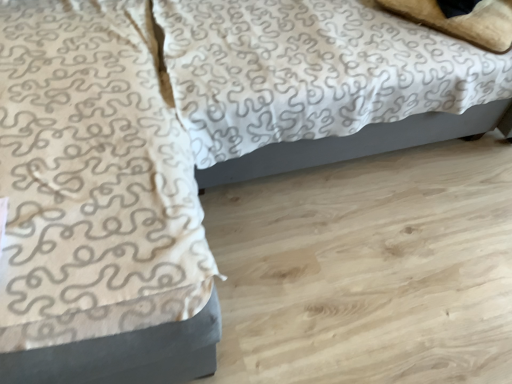
The width and height of the screenshot is (512, 384). Describe the element at coordinates (318, 83) in the screenshot. I see `white textured fabric at center` at that location.

Find the location of a particular element. beige soft pillow at upper right is located at coordinates (462, 21).

Where is `white textured blanket at upper left`? The image size is (512, 384). white textured blanket at upper left is located at coordinates (92, 178).

Which of these two, white textured fabric at center or white textured blanket at upper left, is smaller?

white textured blanket at upper left.

Considering the relative sizes of white textured fabric at center and white textured blanket at upper left in the image provided, is white textured fabric at center wider than white textured blanket at upper left?

Incorrect, the width of white textured fabric at center does not surpass that of white textured blanket at upper left.

Is white textured blanket at upper left located within white textured fabric at center?

No, white textured blanket at upper left is not a part of white textured fabric at center.

Is white textured fabric at center aimed at white textured blanket at upper left?

No, white textured fabric at center does not turn towards white textured blanket at upper left.

Which of these two, beige soft pillow at upper right or white textured blanket at upper left, is thinner?

With smaller width is beige soft pillow at upper right.

In the scene shown: Is beige soft pillow at upper right facing towards white textured blanket at upper left?

Yes, beige soft pillow at upper right is facing white textured blanket at upper left.

From a real-world perspective, is beige soft pillow at upper right located beneath white textured blanket at upper left?

No, from a real-world perspective, beige soft pillow at upper right is not beneath white textured blanket at upper left.

Considering the points (484, 0) and (56, 186), which point is in front, point (484, 0) or point (56, 186)?

Positioned in front is point (56, 186).

How many degrees apart are the facing directions of beige soft pillow at upper right and white textured fabric at center?

There is a 48.4-degree angle between the facing directions of beige soft pillow at upper right and white textured fabric at center.

From a real-world perspective, who is located lower, beige soft pillow at upper right or white textured fabric at center?

In real-world perspective, white textured fabric at center is lower.

Considering the sizes of objects beige soft pillow at upper right and white textured fabric at center in the image provided, who is thinner, beige soft pillow at upper right or white textured fabric at center?

Thinner between the two is beige soft pillow at upper right.

I want to click on pillow above the white textured fabric at center (from a real-world perspective), so click(462, 21).

From a real-world perspective, which is physically below, white textured blanket at upper left or beige soft pillow at upper right?

white textured blanket at upper left, from a real-world perspective.

From the image's perspective, is white textured blanket at upper left above or below beige soft pillow at upper right?

From the image's perspective, white textured blanket at upper left appears below beige soft pillow at upper right.

Looking at their sizes, would you say white textured blanket at upper left is wider or thinner than beige soft pillow at upper right?

In the image, white textured blanket at upper left appears to be wider than beige soft pillow at upper right.

In the scene shown: Which object is positioned more to the right, white textured blanket at upper left or beige soft pillow at upper right?

beige soft pillow at upper right is more to the right.

How many degrees apart are the facing directions of white textured blanket at upper left and white textured fabric at center?

The facing directions of white textured blanket at upper left and white textured fabric at center are 2.19 degrees apart.

Is white textured blanket at upper left taller or shorter than white textured fabric at center?

Considering their sizes, white textured blanket at upper left has less height than white textured fabric at center.

From a real-world perspective, is white textured blanket at upper left under white textured fabric at center?

Indeed, from a real-world perspective, white textured blanket at upper left is positioned beneath white textured fabric at center.

Is white textured fabric at center touching beige soft pillow at upper right?

They are not placed beside each other.

Which object is closer to the camera, white textured fabric at center or beige soft pillow at upper right?

white textured fabric at center is closer to the camera.

Locate an element on the screen. bed located on the left of beige soft pillow at upper right is located at coordinates (318, 83).

Choose the correct answer: Is white textured fabric at center inside beige soft pillow at upper right or outside it?

white textured fabric at center lies outside beige soft pillow at upper right.

Identify the location of bed behind the white textured blanket at upper left. Image resolution: width=512 pixels, height=384 pixels. click(318, 83).

Find the location of a particular element. This screenshot has height=384, width=512. blanket below the beige soft pillow at upper right (from a real-world perspective) is located at coordinates pyautogui.click(x=92, y=178).

Considering their positions, is white textured blanket at upper left positioned further to white textured fabric at center than beige soft pillow at upper right?

white textured blanket at upper left is further to white textured fabric at center.

Consider the image. Looking at the image, which one is located further to beige soft pillow at upper right, white textured blanket at upper left or white textured fabric at center?

white textured blanket at upper left is positioned further to the anchor beige soft pillow at upper right.

Considering their positions, is beige soft pillow at upper right positioned closer to white textured blanket at upper left than white textured fabric at center?

Based on the image, white textured fabric at center appears to be nearer to white textured blanket at upper left.

In the scene shown: When comparing their distances from beige soft pillow at upper right, does white textured fabric at center or white textured blanket at upper left seem closer?

white textured fabric at center is positioned closer to the anchor beige soft pillow at upper right.

Looking at the image, which one is located closer to white textured fabric at center, beige soft pillow at upper right or white textured blanket at upper left?

beige soft pillow at upper right is closer to white textured fabric at center.

From the image, which object appears to be nearer to white textured blanket at upper left, white textured fabric at center or beige soft pillow at upper right?

The object closer to white textured blanket at upper left is white textured fabric at center.

What are the coordinates of `bed between white textured blanket at upper left and beige soft pillow at upper right` in the screenshot? It's located at (318, 83).